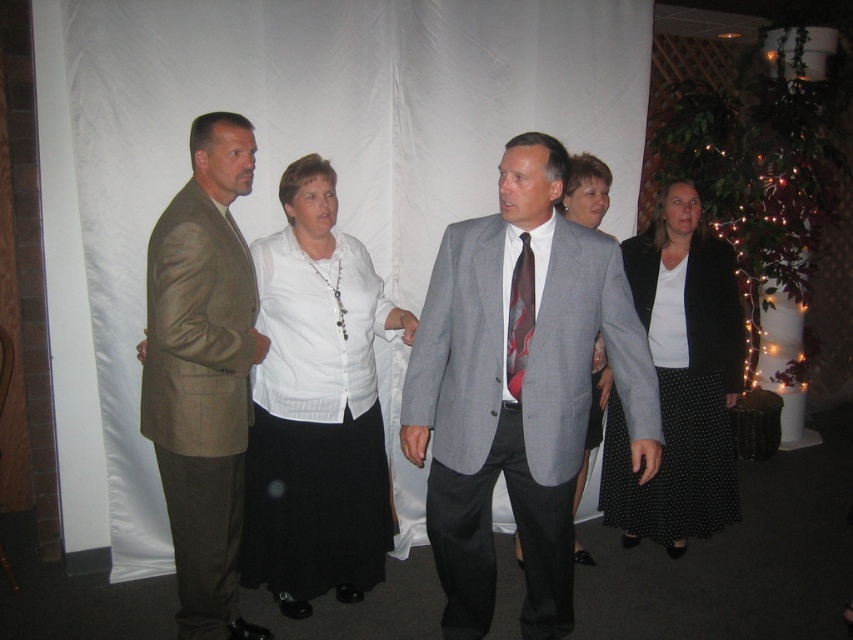
Is point (132, 452) closer to viewer compared to point (450, 326)?

No, it is not.

The width and height of the screenshot is (853, 640). What are the coordinates of `white fabric at center` in the screenshot? It's located at (285, 164).

Which is in front, point (187, 99) or point (500, 234)?

Point (500, 234) is more forward.

This screenshot has height=640, width=853. Identify the location of white fabric at center. (285, 164).

Between white matte shirt at center and khaki fabric suit at left, which one appears on the right side from the viewer's perspective?

white matte shirt at center is more to the right.

What do you see at coordinates (316, 406) in the screenshot? I see `white matte shirt at center` at bounding box center [316, 406].

Consider the image. Who is more forward, (x=343, y=458) or (x=225, y=387)?

Point (x=225, y=387) is in front.

Identify the location of white matte shirt at center. Image resolution: width=853 pixels, height=640 pixels. (316, 406).

Is white matte shirt at center wider than red and black striped tie at center?

Indeed, white matte shirt at center has a greater width compared to red and black striped tie at center.

Find the location of a particular element. white matte shirt at center is located at coordinates (316, 406).